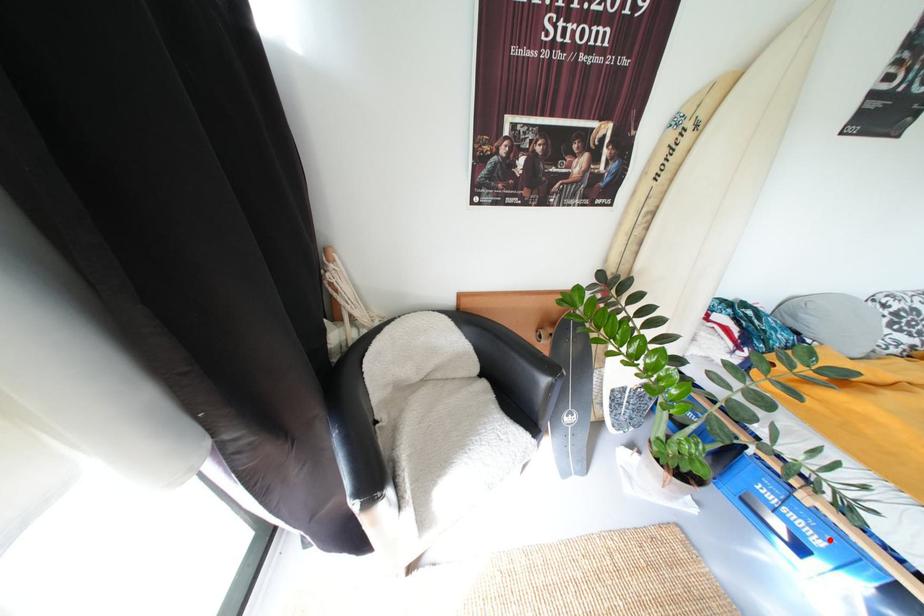
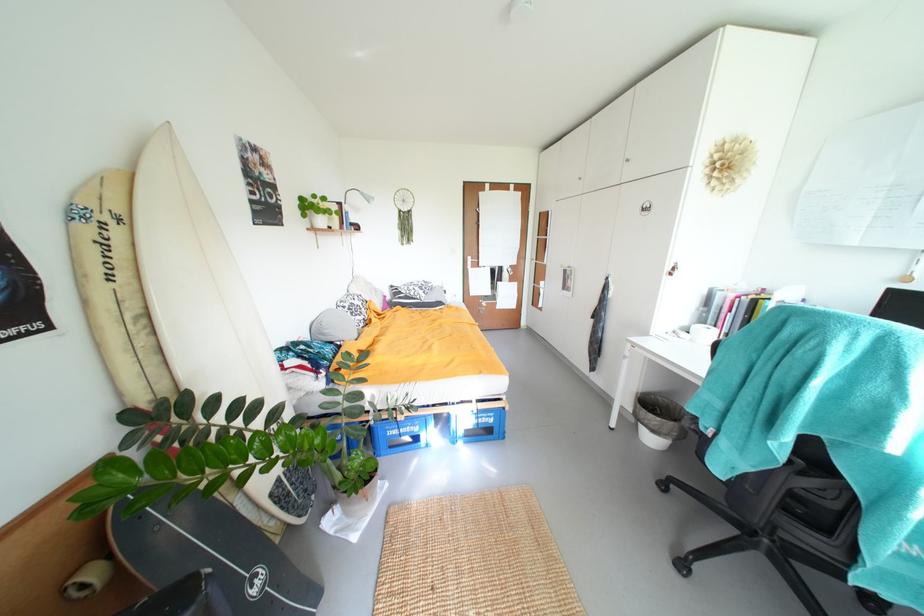
Question: I am providing you with two images of the same scene from different viewpoints. A red point is marked on the first image. At the location where the point appears in image 1, is it still visible in image 2?

Choices:
 (A) Yes
 (B) No

Answer: (A)